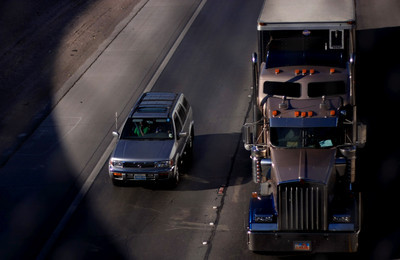
Locate an element on the screen. The image size is (400, 260). door is located at coordinates (187, 129).